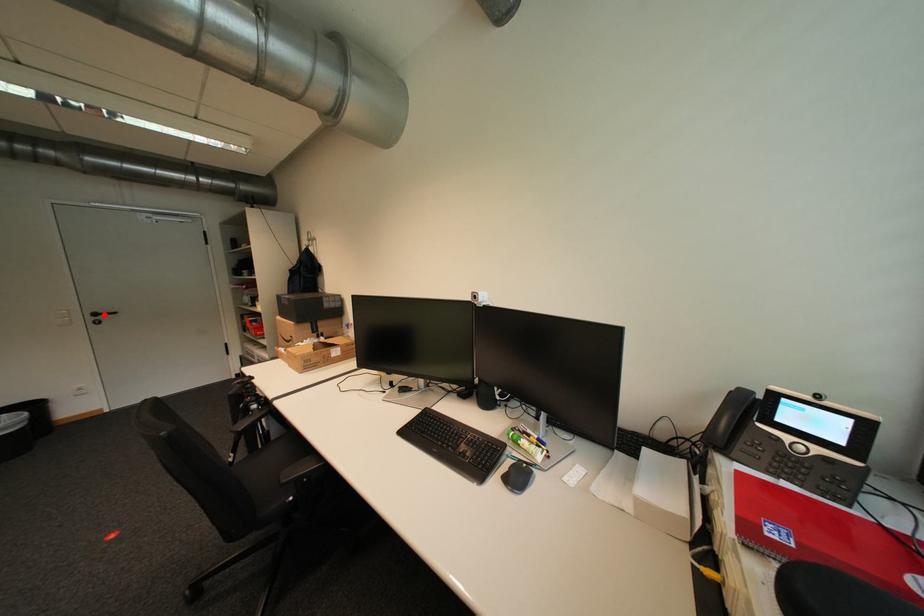
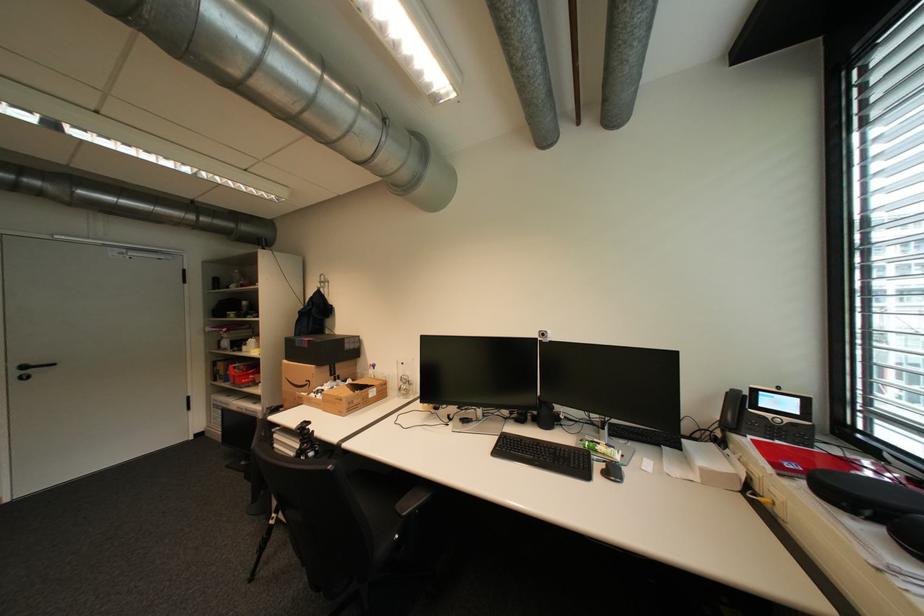
The point at the highlighted location is marked in the first image. Where is the corresponding point in the second image?

(32, 368)